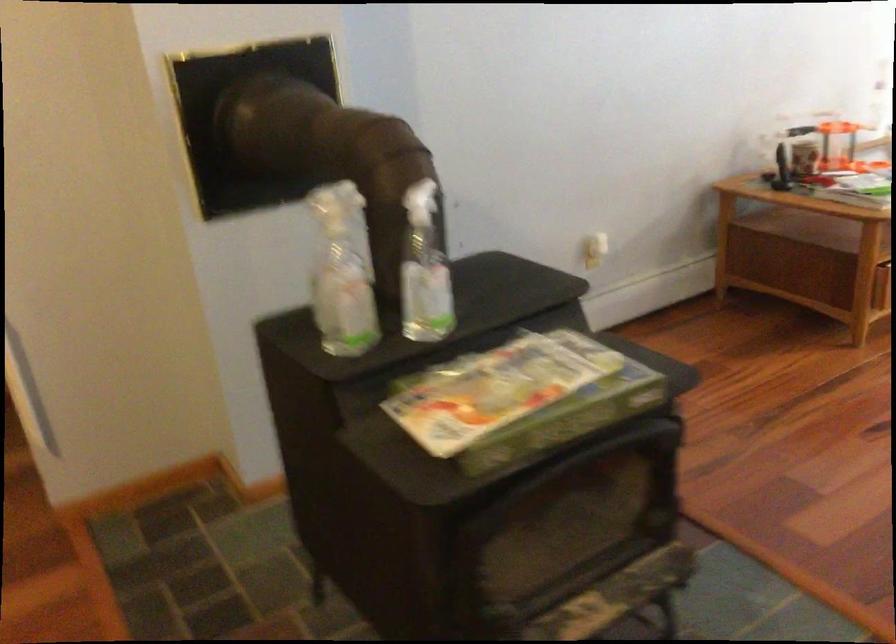
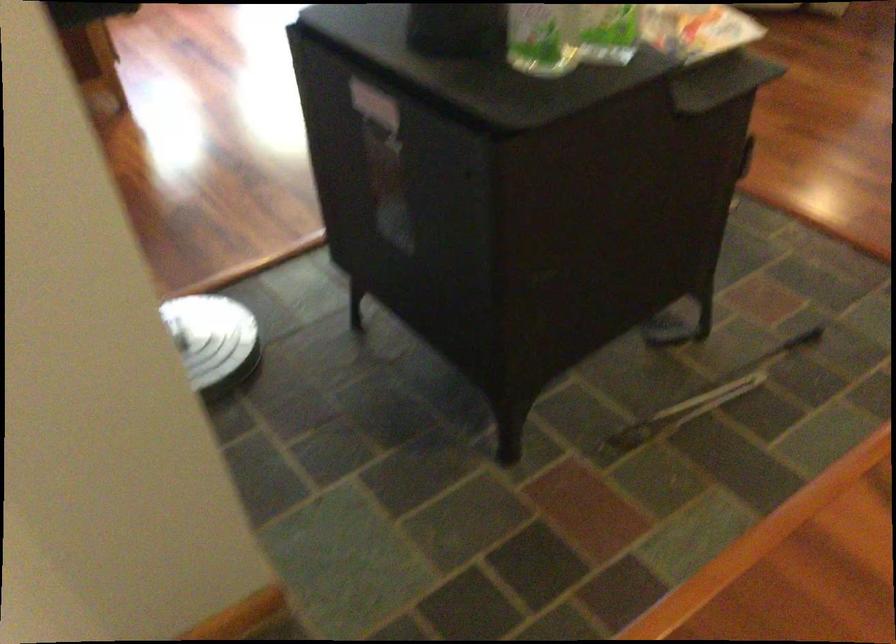
In the second image, find the point that corresponds to pixel 326 296 in the first image.

(541, 38)